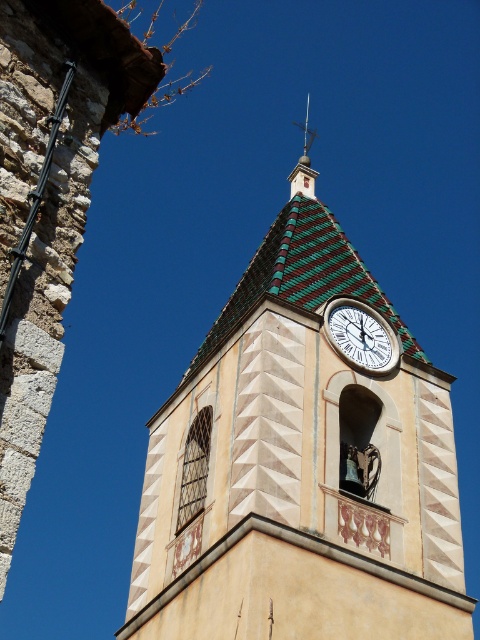
Question: Which object is positioned closest to the green striped spire at upper center?

Choices:
 (A) green and white tiled clock tower at center
 (B) white glossy clock at upper center

Answer: (B)

Question: Is the position of white glossy clock at upper center less distant than that of green striped spire at upper center?

Choices:
 (A) no
 (B) yes

Answer: (B)

Question: Can you confirm if green and white tiled clock tower at center is bigger than green striped spire at upper center?

Choices:
 (A) no
 (B) yes

Answer: (A)

Question: Which is nearer to the green and white tiled clock tower at center?

Choices:
 (A) white glossy clock at upper center
 (B) green striped spire at upper center

Answer: (A)

Question: Considering the relative positions of green and white tiled clock tower at center and white glossy clock at upper center in the image provided, where is green and white tiled clock tower at center located with respect to white glossy clock at upper center?

Choices:
 (A) below
 (B) above

Answer: (A)

Question: Which object is farther from the camera taking this photo?

Choices:
 (A) green striped spire at upper center
 (B) green and white tiled clock tower at center
 (C) white glossy clock at upper center

Answer: (A)